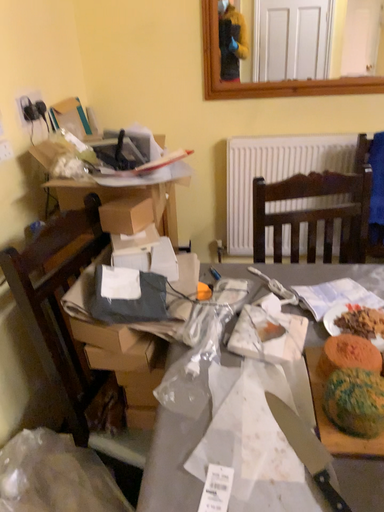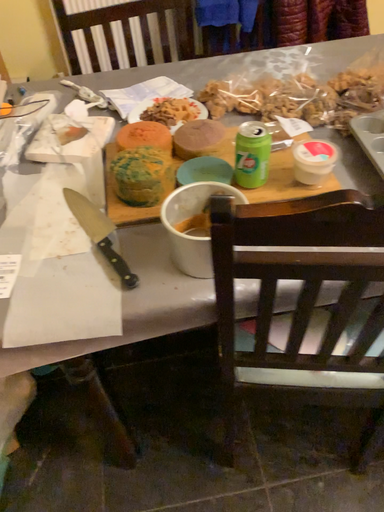
Question: Which way did the camera rotate in the video?

Choices:
 (A) rotated upward
 (B) rotated downward

Answer: (B)